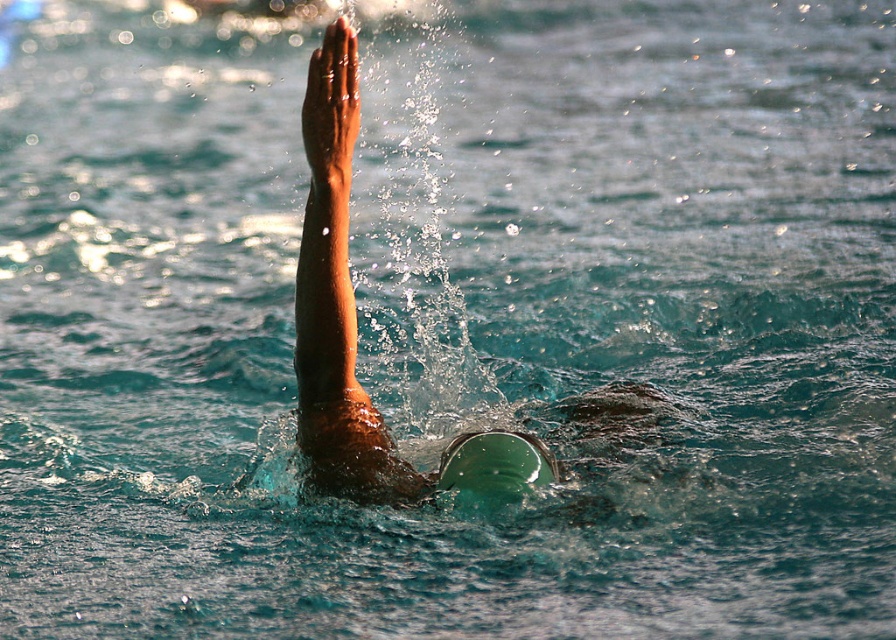
Does point (464, 60) come closer to viewer compared to point (481, 456)?

No.

Locate an element on the screen. The height and width of the screenshot is (640, 896). clear water splash at upper center is located at coordinates tap(415, 248).

Does point (437, 68) come farther from viewer compared to point (346, 337)?

Yes.

Does point (426, 410) come closer to viewer compared to point (330, 483)?

No, it is not.

Identify the location of clear water splash at upper center. Image resolution: width=896 pixels, height=640 pixels. (415, 248).

Image resolution: width=896 pixels, height=640 pixels. I want to click on matte skin at center, so click(x=337, y=304).

Does matte skin at center appear over green rubber swim cap at center?

Indeed, matte skin at center is positioned over green rubber swim cap at center.

Where is `matte skin at center`? The image size is (896, 640). matte skin at center is located at coordinates (337, 304).